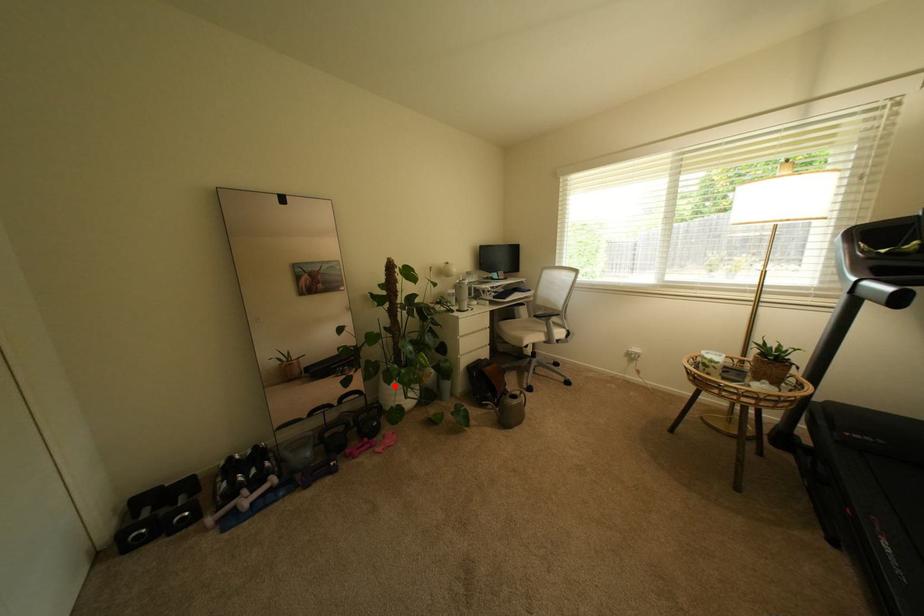
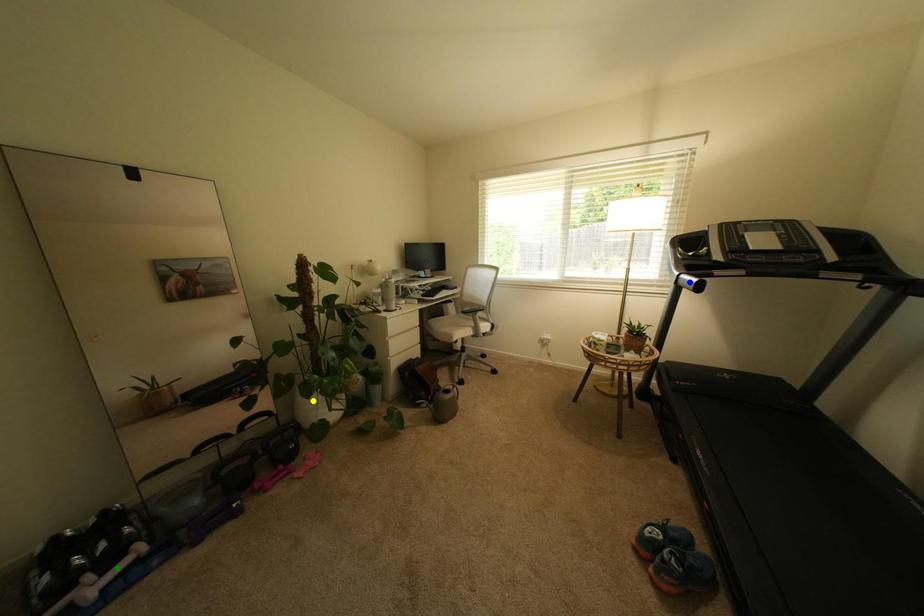
Question: I am providing you with two images of the same scene from different viewpoints. A red point is marked on the first image. You are given multiple points on the second image. In image 2, which mark is for the same physical point as the one in image 1?

Choices:
 (A) yellow point
 (B) green point
 (C) blue point

Answer: (A)